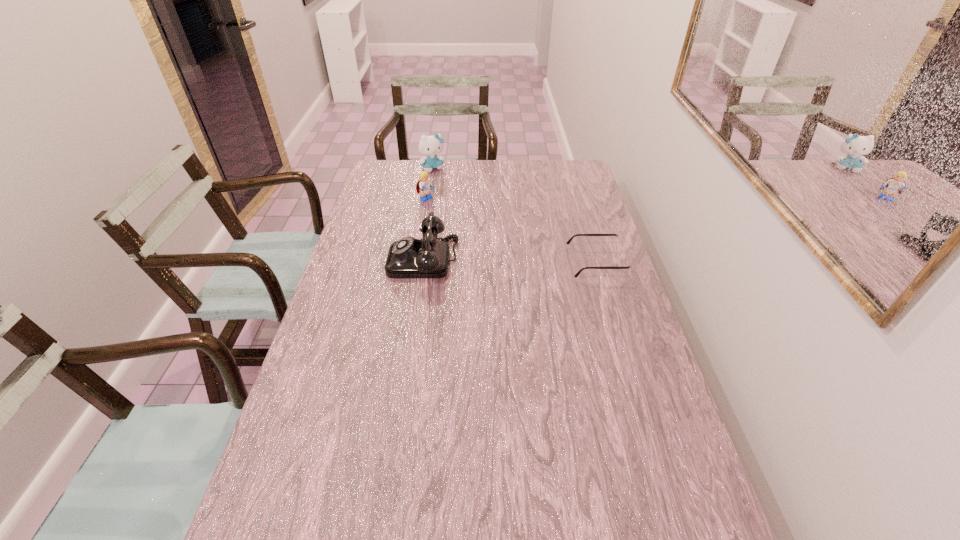
At what (x,y) coordinates should I click in order to perform the action: click on vacant region located on the front-facing side of the third nearest object. Please return your answer as a coordinate pair (x, y). This screenshot has width=960, height=540. Looking at the image, I should click on (481, 236).

This screenshot has width=960, height=540. What are the coordinates of `vacant space located on the face of the kitten` in the screenshot? It's located at (460, 198).

At what (x,y) coordinates should I click in order to perform the action: click on vacant space located 0.300m on the face of the kitten. Please return your answer as a coordinate pair (x, y). This screenshot has height=540, width=960. Looking at the image, I should click on (468, 208).

At what (x,y) coordinates should I click in order to perform the action: click on free location located 0.370m on the face of the kitten. Please return your answer as a coordinate pair (x, y). This screenshot has width=960, height=540. Looking at the image, I should click on (477, 218).

This screenshot has height=540, width=960. Find the location of `object positioned at the far edge`. object positioned at the far edge is located at coordinates (430, 146).

The width and height of the screenshot is (960, 540). Find the location of `object that is at the left edge`. object that is at the left edge is located at coordinates (409, 257).

Locate an element on the screen. This screenshot has height=540, width=960. object that is positioned at the right edge is located at coordinates (619, 244).

In the image, there is a desktop. Identify the location of free region at the far edge. (480, 184).

Where is `vacant area at the near edge of the desktop`? This screenshot has width=960, height=540. vacant area at the near edge of the desktop is located at coordinates (536, 539).

In the image, there is a desktop. At what (x,y) coordinates should I click in order to perform the action: click on blank space at the left edge. Please return your answer as a coordinate pair (x, y). Image resolution: width=960 pixels, height=540 pixels. Looking at the image, I should click on (342, 341).